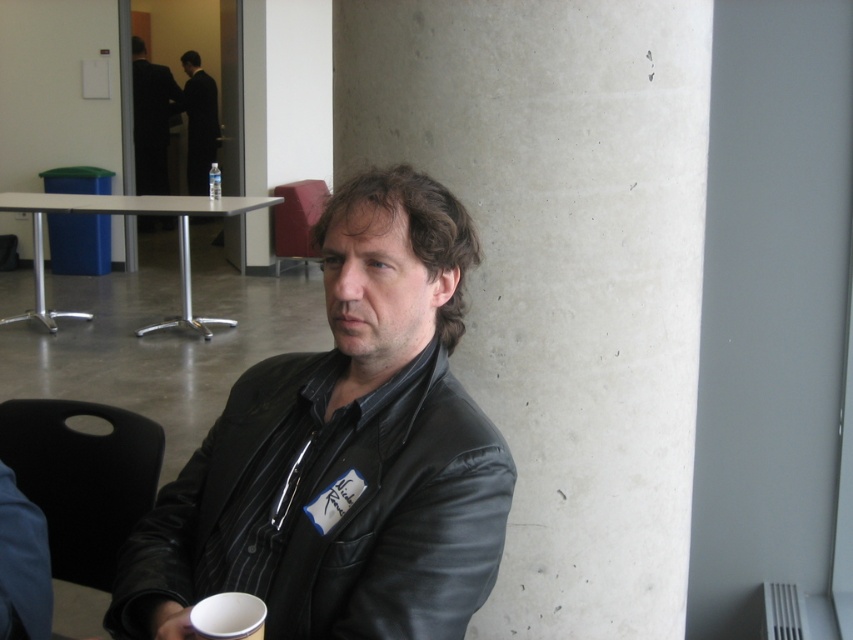
You are a photographer setting up for an event. You notice the dark suit at upper left and the clear plastic bottle at center in the frame. Which object should you adjust your camera angle to focus on if you want to capture the one that is higher in the image?

The dark suit at upper left is above the clear plastic bottle at center, so you should focus on the dark suit at upper left to capture the higher object.

You are standing in the conference room and want to locate the concrete pillar at center. What are the coordinates where you can find it?

The concrete pillar at center can be found at coordinates point (x=561, y=272).